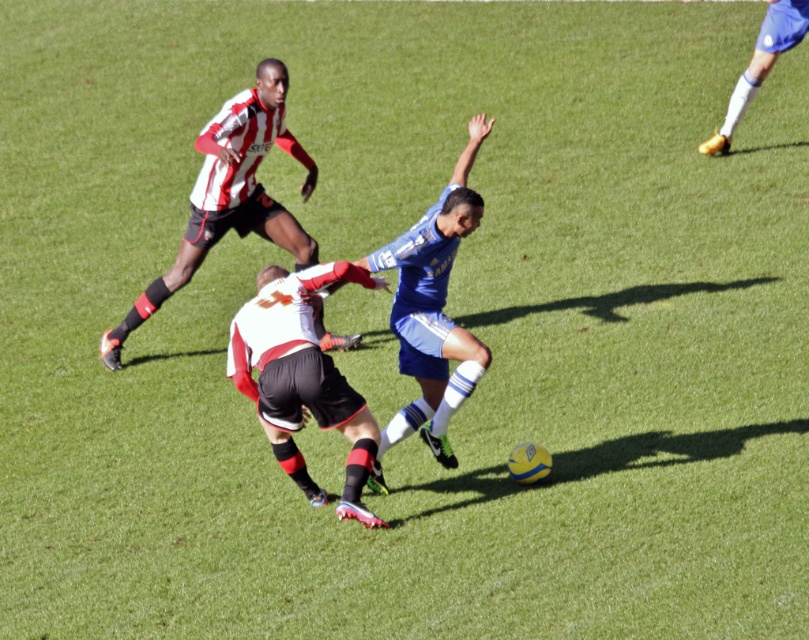
Who is more distant from viewer, (397, 422) or (778, 26)?

The point (778, 26) is more distant.

Does blue matte jersey at center appear under gold metallic boot at upper right?

Yes.

I want to click on blue matte jersey at center, so click(x=433, y=305).

Between white matte soccer cleat at lower center and blue matte jersey at center, which one has less height?

white matte soccer cleat at lower center is shorter.

Who is lower down, white matte soccer cleat at lower center or blue matte jersey at center?

white matte soccer cleat at lower center is below.

Who is more forward, [291,285] or [466,196]?

Point [466,196]

Image resolution: width=809 pixels, height=640 pixels. Find the location of `white matte soccer cleat at lower center`. white matte soccer cleat at lower center is located at coordinates (303, 378).

Can you confirm if white matte soccer cleat at lower center is positioned above striped jersey at upper left?

Incorrect, white matte soccer cleat at lower center is not positioned above striped jersey at upper left.

Which is in front, point (356, 460) or point (244, 212)?

Point (356, 460)

Is point (256, 365) farther from camera compared to point (140, 314)?

No.

The width and height of the screenshot is (809, 640). What are the coordinates of `white matte soccer cleat at lower center` in the screenshot? It's located at (303, 378).